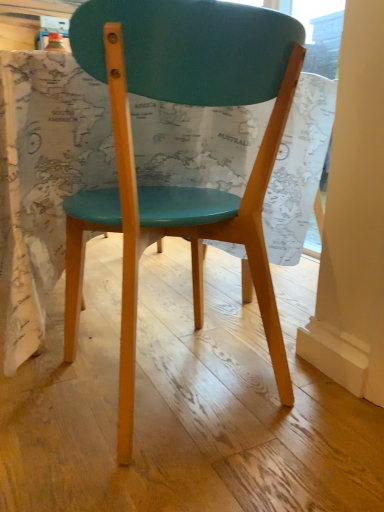
Locate an element on the screen. The image size is (384, 512). free point behind teal matte wood chair at center is located at coordinates (173, 320).